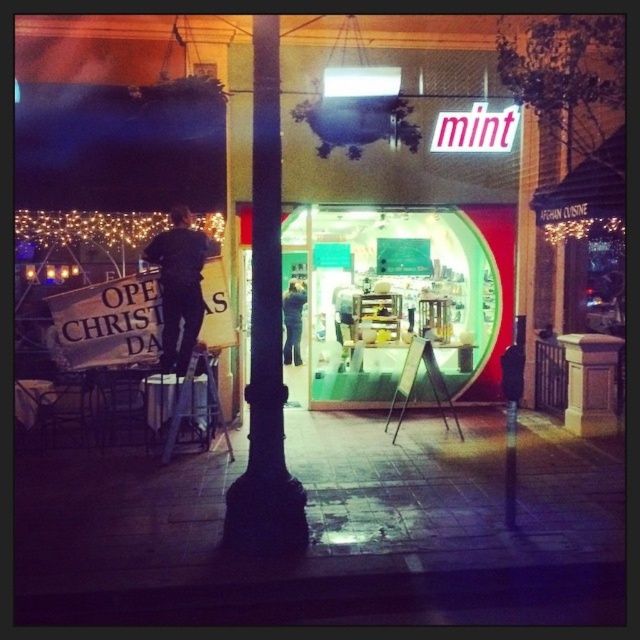
Question: Which of the following is the farthest from the observer?

Choices:
 (A) black matte pole at center
 (B) illuminated string lights at upper left
 (C) metallic silver ladder at center
 (D) dark blue jeans at left

Answer: (B)

Question: Does illuminated string lights at upper left appear under metallic silver ladder at center?

Choices:
 (A) yes
 (B) no

Answer: (B)

Question: Can you confirm if black matte pole at center is positioned to the left of dark blue jeans at left?

Choices:
 (A) yes
 (B) no

Answer: (B)

Question: Is black matte pole at center wider than dark blue jeans at left?

Choices:
 (A) no
 (B) yes

Answer: (B)

Question: Based on their relative distances, which object is nearer to the dark blue jeans at left?

Choices:
 (A) illuminated string lights at upper left
 (B) metallic silver ladder at center

Answer: (B)

Question: Which point is farther to the camera?

Choices:
 (A) dark blue jeans at left
 (B) illuminated string lights at upper left
 (C) metallic silver ladder at center
 (D) black matte pole at center

Answer: (B)